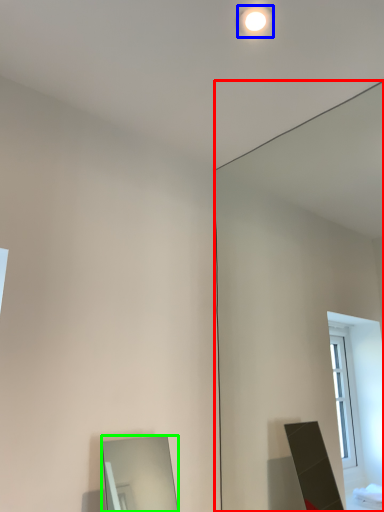
Question: Which object is the closest to the mirror (highlighted by a red box)? Choose among these: lighting (highlighted by a blue box) or mirror (highlighted by a green box).

Choices:
 (A) lighting
 (B) mirror

Answer: (A)